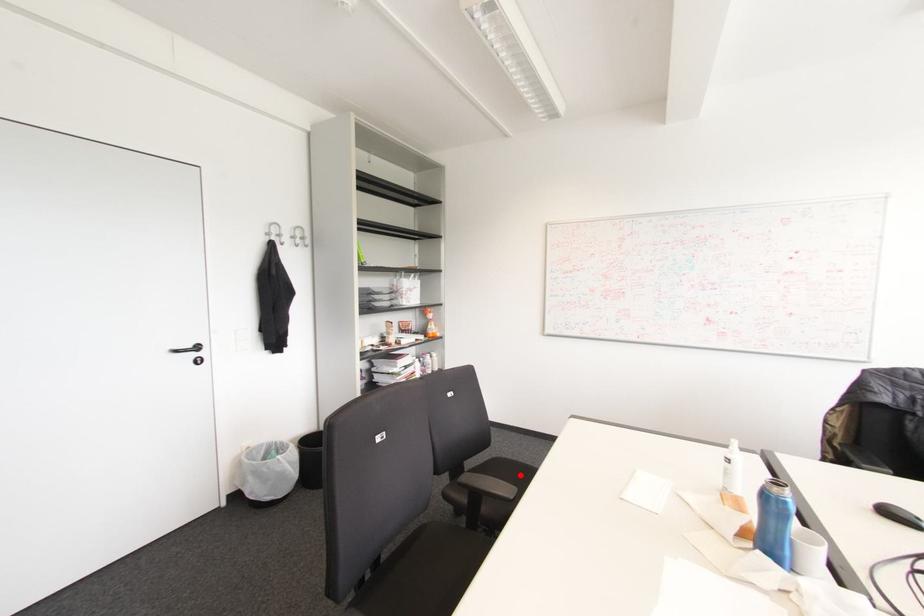
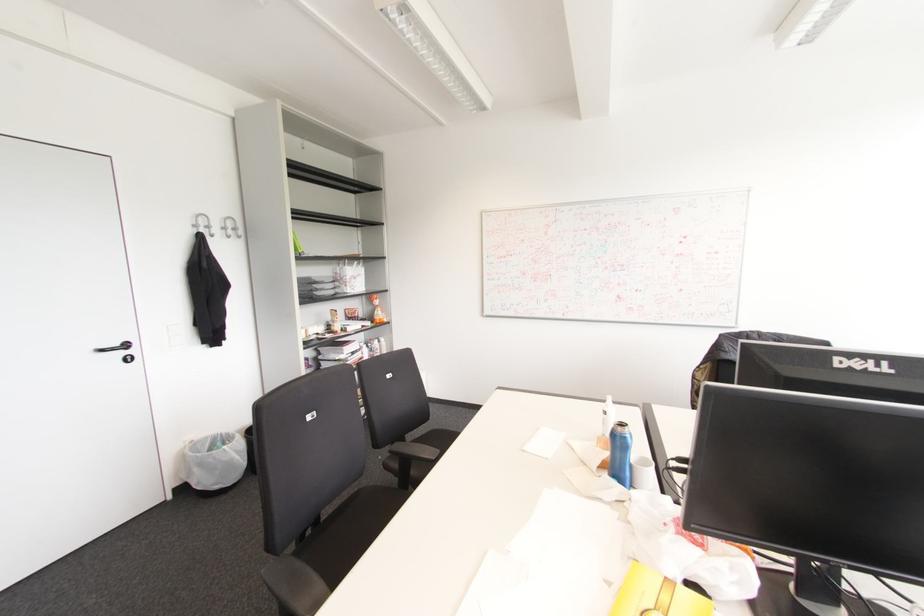
Find the pixel in the second image that matches the highlighted location in the first image.

(444, 439)